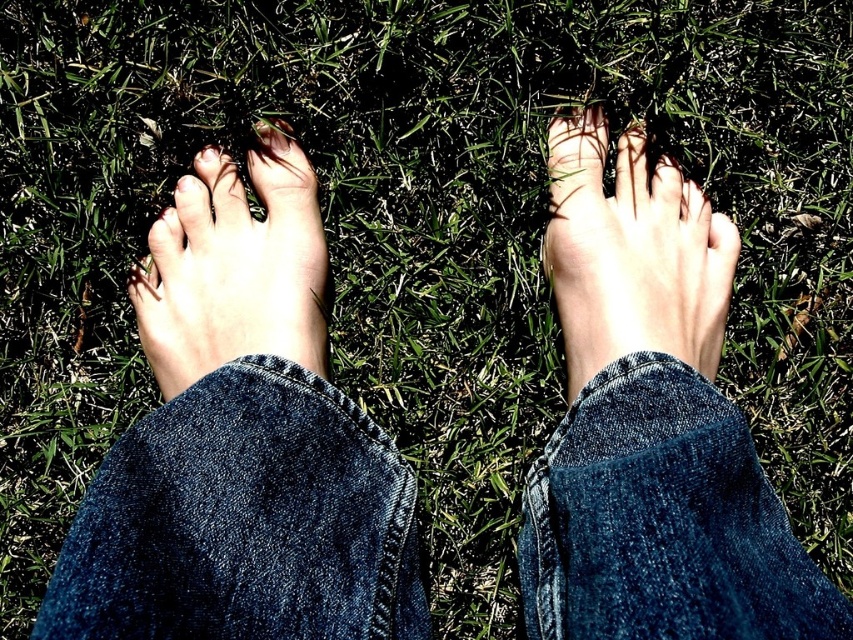
You are trying to determine if your foot can fit into a pair of shoes. Based on the image, is the pale skin foot at center shorter than the denim at center?

The denim at center is not as tall as the pale skin foot at center, so the pale skin foot at center is taller than the denim at center. Therefore, the foot is not shorter than the denim.

You are a photographer trying to capture the shadow of the pale skin foot at center. Since the denim at center is below it, where should you position your camera relative to the foot to ensure the shadow falls on the denim?

To ensure the shadow of the pale skin foot at center falls on the denim at center, position the camera above the foot facing downward, as the denim is located below the foot and sunlight is present.